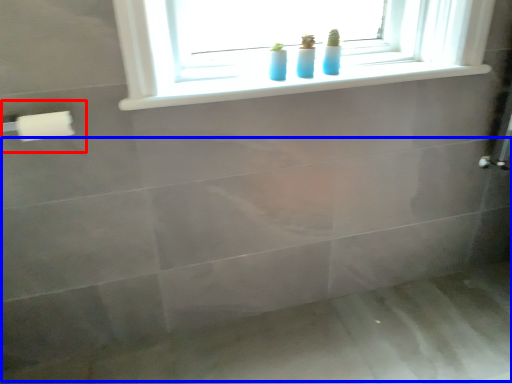
Question: Which object appears farthest to the camera in this image, towel bar (highlighted by a red box) or bath (highlighted by a blue box)?

Choices:
 (A) towel bar
 (B) bath

Answer: (B)